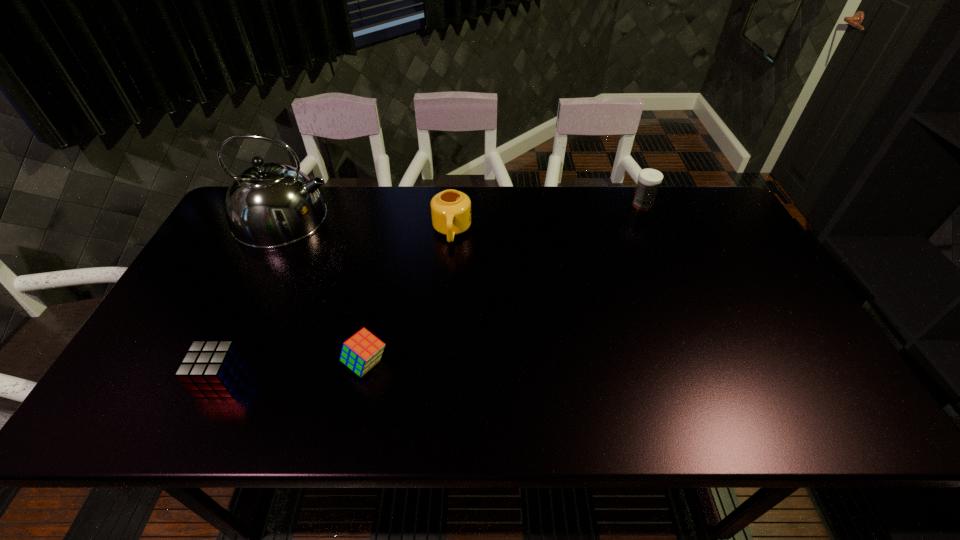
Locate an element on the screen. The width and height of the screenshot is (960, 540). the tallest object is located at coordinates (269, 205).

Locate an element on the screen. The image size is (960, 540). mug is located at coordinates (451, 210).

At what (x,y) coordinates should I click in order to perform the action: click on medicine. Please return your answer as a coordinate pair (x, y). The image size is (960, 540). Looking at the image, I should click on (649, 179).

The height and width of the screenshot is (540, 960). I want to click on the right cube, so click(x=362, y=351).

Find the location of `the left cube`. the left cube is located at coordinates (210, 368).

Where is `free space located from the spout of the tallest object`? The height and width of the screenshot is (540, 960). free space located from the spout of the tallest object is located at coordinates 407,218.

Find the location of a particular element. free space located 0.280m on the handle side of the fourth object from left to right is located at coordinates (445, 325).

Identify the location of free spot located on the right of the rightmost object. The image size is (960, 540). [x=692, y=205].

The width and height of the screenshot is (960, 540). What are the coordinates of `vacant space located 0.310m on the back of the right cube` in the screenshot? It's located at (388, 258).

Image resolution: width=960 pixels, height=540 pixels. I want to click on free space located on the right of the left cube, so 391,380.